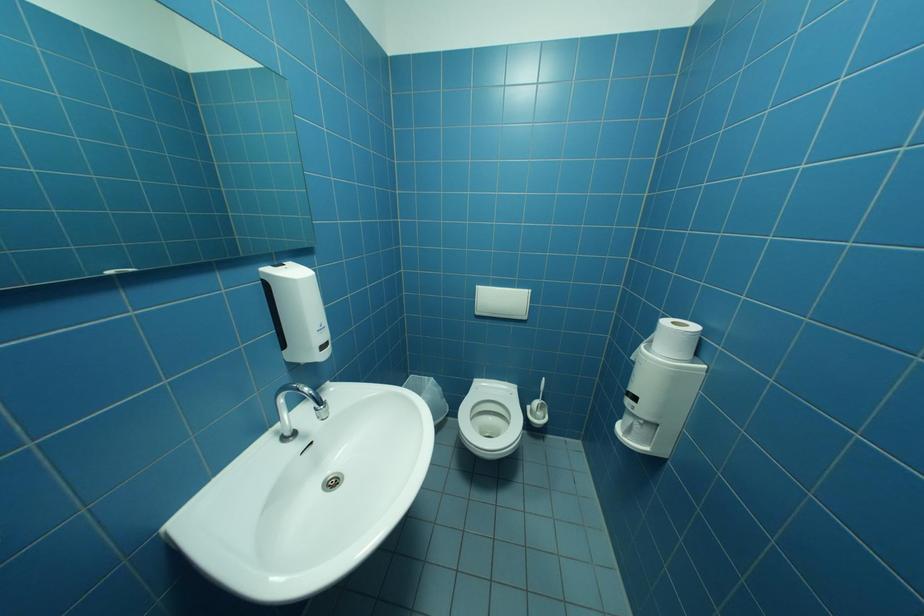
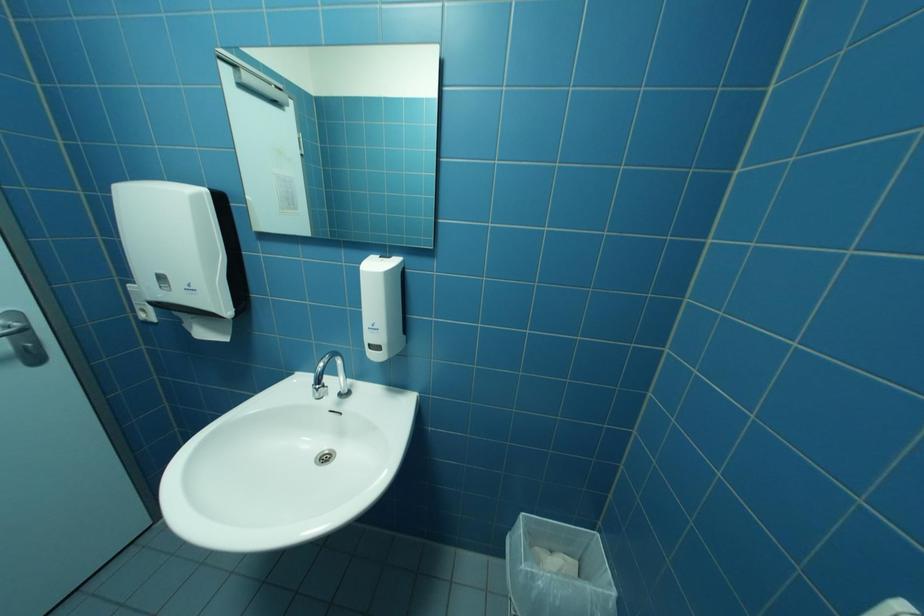
The images are taken continuously from a first-person perspective. In which direction is your viewpoint rotating?

The camera rotated toward left-down.